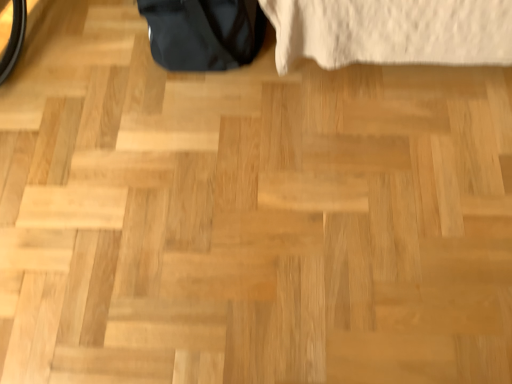
Image resolution: width=512 pixels, height=384 pixels. What are the coordinates of `free space in front of glossy black bag at upper left` in the screenshot? It's located at (214, 126).